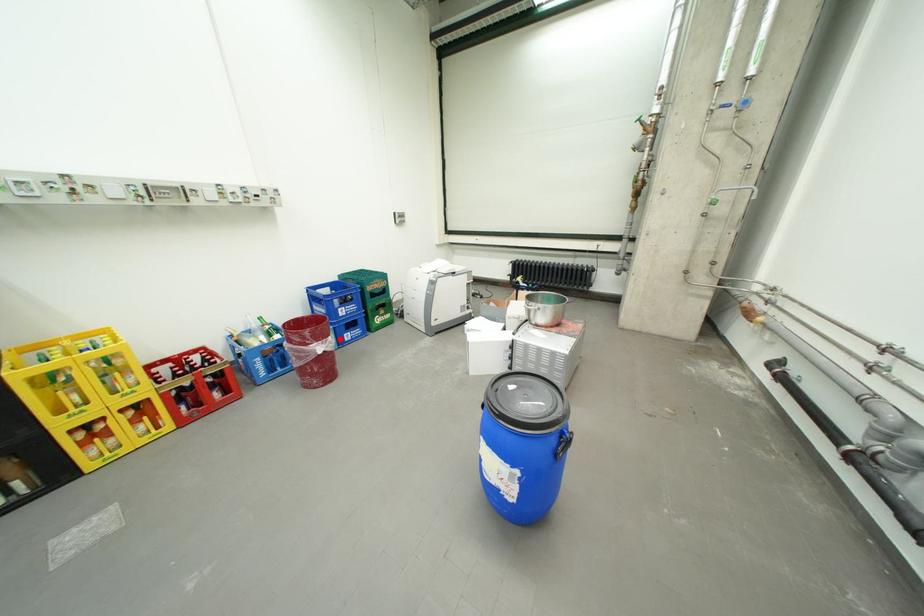
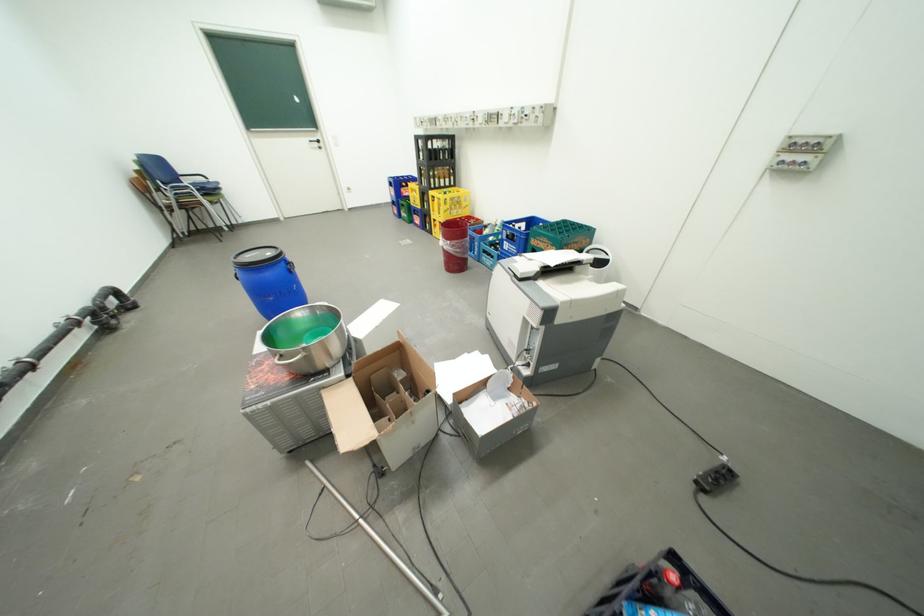
Where in the second image is the point corresponding to the highlighted location from the first image?

(459, 243)